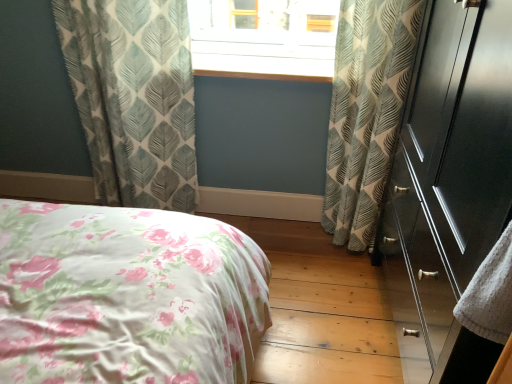
Question: Is light blue textured curtains at upper left, acting as the 1th curtain starting from the left, positioned with its back to wooden at center?

Choices:
 (A) no
 (B) yes

Answer: (A)

Question: From a real-world perspective, is light blue textured curtains at upper left, acting as the 1th curtain starting from the left, over wooden at center?

Choices:
 (A) yes
 (B) no

Answer: (B)

Question: Is light blue textured curtains at upper left, marked as the second curtain in a right-to-left arrangement, behind wooden at center?

Choices:
 (A) no
 (B) yes

Answer: (A)

Question: Considering the relative sizes of light blue textured curtains at upper left, acting as the 1th curtain starting from the left, and wooden at center in the image provided, is light blue textured curtains at upper left, acting as the 1th curtain starting from the left, bigger than wooden at center?

Choices:
 (A) no
 (B) yes

Answer: (B)

Question: Is light blue textured curtains at upper left, acting as the 1th curtain starting from the left, at the left side of wooden at center?

Choices:
 (A) no
 (B) yes

Answer: (B)

Question: Is wooden at center in front of or behind leaf-patterned fabric curtain at right, positioned as the 1th curtain in right-to-left order, in the image?

Choices:
 (A) front
 (B) behind

Answer: (B)

Question: In terms of size, does wooden at center appear bigger or smaller than leaf-patterned fabric curtain at right, positioned as the 1th curtain in right-to-left order?

Choices:
 (A) big
 (B) small

Answer: (B)

Question: Considering the positions of point (284, 56) and point (348, 162), is point (284, 56) closer or farther from the camera than point (348, 162)?

Choices:
 (A) farther
 (B) closer

Answer: (A)

Question: Considering the positions of wooden at center and leaf-patterned fabric curtain at right, the 2th curtain from the left, in the image, is wooden at center taller or shorter than leaf-patterned fabric curtain at right, the 2th curtain from the left,?

Choices:
 (A) short
 (B) tall

Answer: (A)

Question: Considering the positions of point (373, 137) and point (126, 48), is point (373, 137) closer or farther from the camera than point (126, 48)?

Choices:
 (A) closer
 (B) farther

Answer: (B)

Question: Is leaf-patterned fabric curtain at right, positioned as the 1th curtain in right-to-left order, bigger or smaller than light blue textured curtains at upper left, acting as the 1th curtain starting from the left?

Choices:
 (A) small
 (B) big

Answer: (A)

Question: From a real-world perspective, is leaf-patterned fabric curtain at right, the 2th curtain from the left, positioned above or below light blue textured curtains at upper left, marked as the second curtain in a right-to-left arrangement?

Choices:
 (A) above
 (B) below

Answer: (A)

Question: Is leaf-patterned fabric curtain at right, positioned as the 1th curtain in right-to-left order, spatially inside light blue textured curtains at upper left, marked as the second curtain in a right-to-left arrangement, or outside of it?

Choices:
 (A) inside
 (B) outside

Answer: (B)

Question: Considering their positions, is glossy dark wood dresser at right located in front of or behind light blue textured curtains at upper left, acting as the 1th curtain starting from the left?

Choices:
 (A) behind
 (B) front

Answer: (B)

Question: In terms of height, does glossy dark wood dresser at right look taller or shorter compared to light blue textured curtains at upper left, marked as the second curtain in a right-to-left arrangement?

Choices:
 (A) short
 (B) tall

Answer: (B)